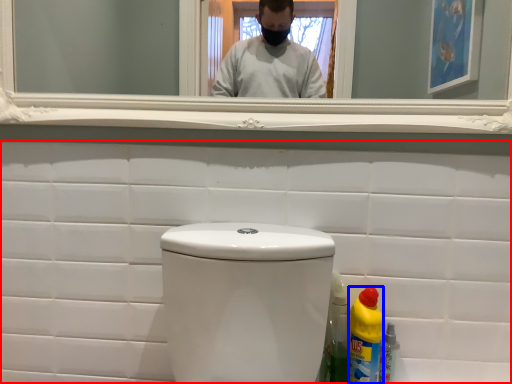
Question: Which of the following is the closest to the observer, porcelain (highlighted by a red box) or bottle (highlighted by a blue box)?

Choices:
 (A) porcelain
 (B) bottle

Answer: (B)